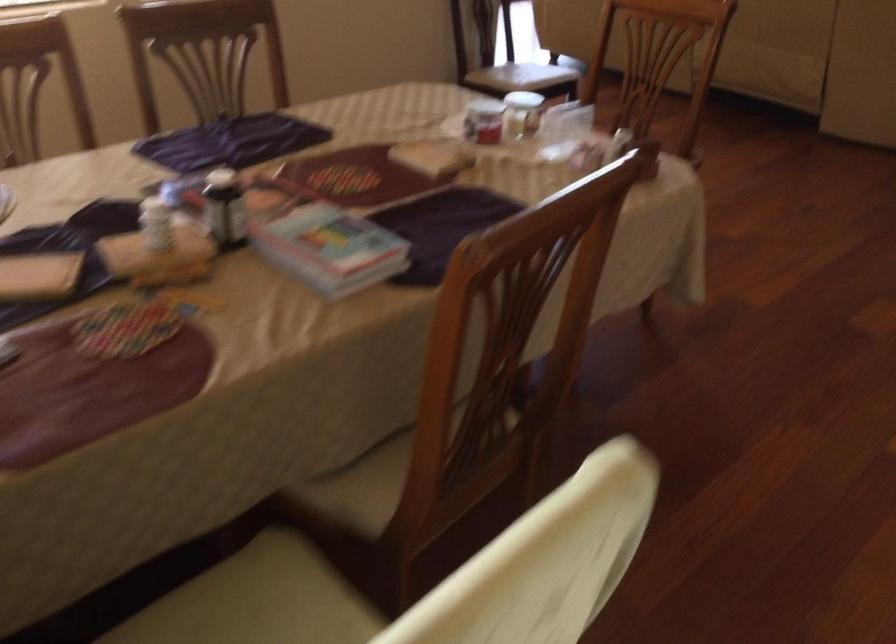
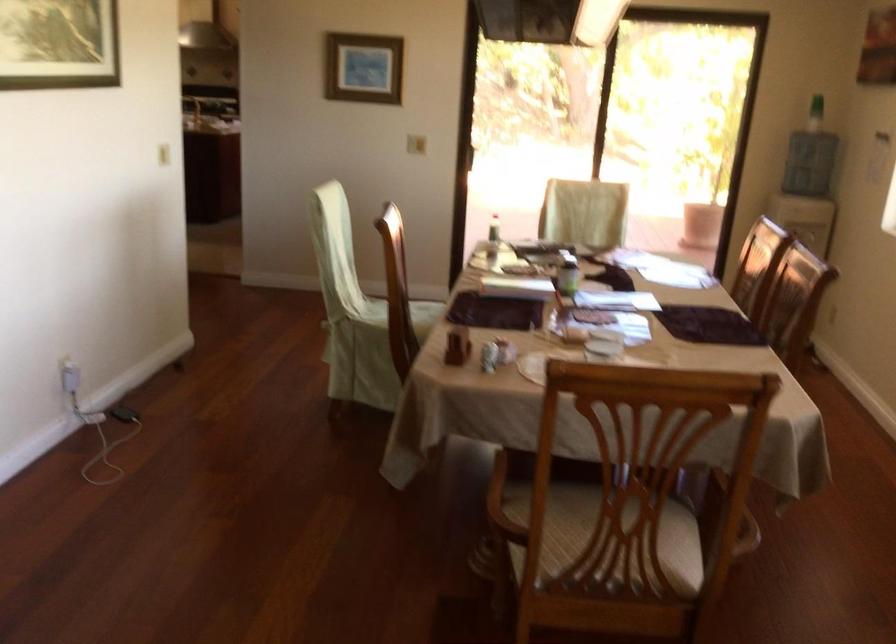
In the second image, find the point that corresponds to (x=590, y=84) in the first image.

(722, 509)